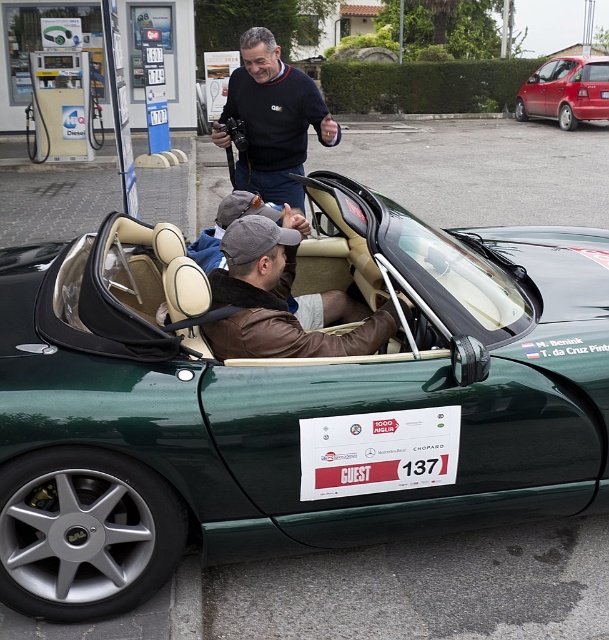
Question: Is green leather convertible at center in front of matte black sweater at center?

Choices:
 (A) yes
 (B) no

Answer: (A)

Question: Which point appears farthest from the camera in this image?

Choices:
 (A) (29, 518)
 (B) (417, 460)
 (C) (269, 141)

Answer: (C)

Question: Observing the image, what is the correct spatial positioning of green leather convertible at center in reference to brown leather jacket at center?

Choices:
 (A) above
 (B) below

Answer: (B)

Question: Can you confirm if green leather convertible at center is smaller than matte black sweater at center?

Choices:
 (A) yes
 (B) no

Answer: (B)

Question: Considering the real-world distances, which object is closest to the brown leather jacket at center?

Choices:
 (A) green leather convertible at center
 (B) metallic red hatchback at upper right
 (C) white paper sign at center
 (D) matte black sweater at center

Answer: (A)

Question: Which point appears closest to the camera in this image?

Choices:
 (A) (596, 58)
 (B) (294, 534)
 (C) (423, 465)

Answer: (C)